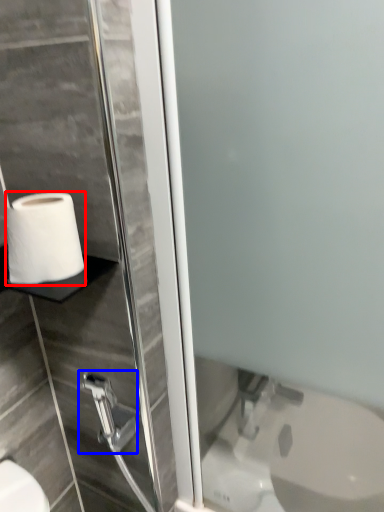
Question: Among these objects, which one is farthest to the camera, toilet paper (highlighted by a red box) or shower (highlighted by a blue box)?

Choices:
 (A) toilet paper
 (B) shower

Answer: (B)